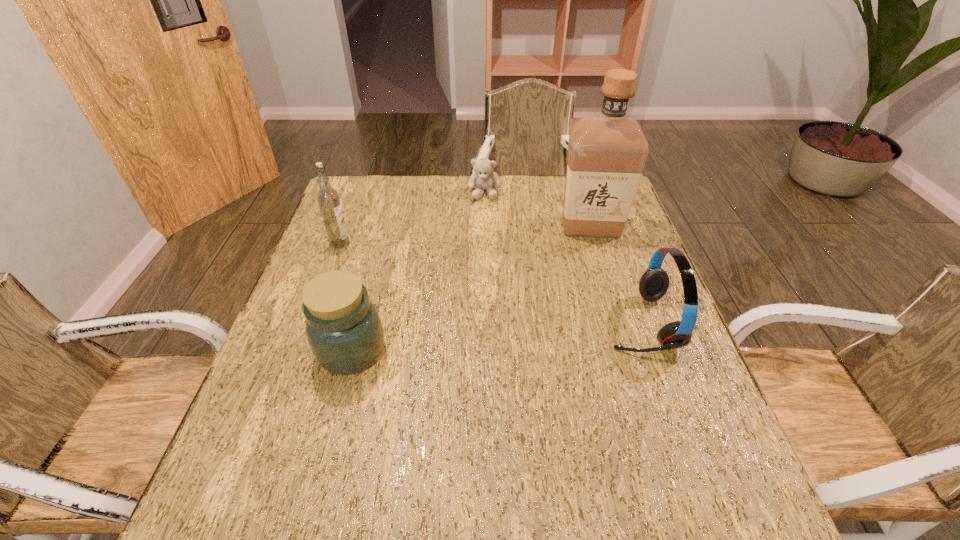
Where is `liquor present at the far edge`? This screenshot has width=960, height=540. liquor present at the far edge is located at coordinates (607, 152).

The width and height of the screenshot is (960, 540). I want to click on teddy bear present at the far edge, so click(484, 178).

Locate an element on the screen. jar that is positioned at the left edge is located at coordinates (343, 327).

Image resolution: width=960 pixels, height=540 pixels. What are the coordinates of `vodka positioned at the left edge` in the screenshot? It's located at (327, 197).

Identify the location of headset that is at the right edge. The image size is (960, 540). (653, 284).

Where is `liquor positioned at the right edge`? Image resolution: width=960 pixels, height=540 pixels. liquor positioned at the right edge is located at coordinates point(607,152).

Locate an element on the screen. The image size is (960, 540). object present at the far right corner is located at coordinates (607, 152).

At what (x,y) coordinates should I click in order to perform the action: click on vacant area at the far edge. Please return your answer as a coordinate pair (x, y). The height and width of the screenshot is (540, 960). Looking at the image, I should click on (452, 190).

Locate an element on the screen. This screenshot has width=960, height=540. vacant position at the near edge of the desktop is located at coordinates click(553, 464).

Identify the location of free location at the left edge. This screenshot has height=540, width=960. (368, 227).